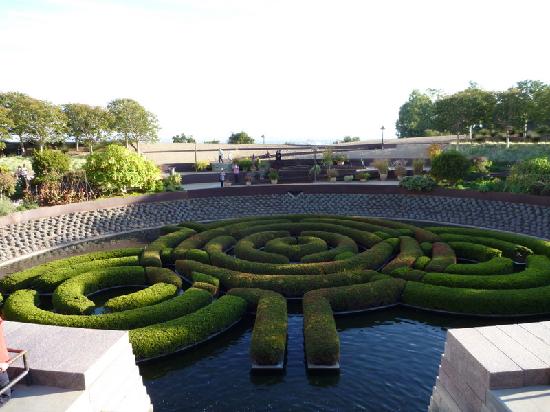
Where is `wall`? The image size is (550, 412). wall is located at coordinates (174, 148).